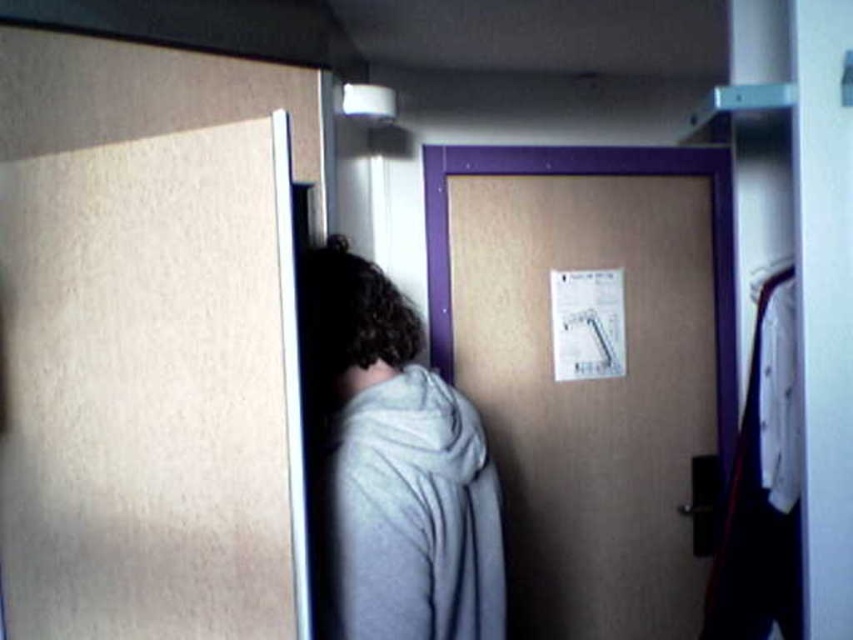
Question: Does gray fleece robe at center appear over wooden door at center?

Choices:
 (A) yes
 (B) no

Answer: (B)

Question: In this image, where is gray fleece robe at center located relative to wooden door at center?

Choices:
 (A) left
 (B) right

Answer: (A)

Question: Which point is closer to the camera?

Choices:
 (A) (711, 188)
 (B) (463, 481)

Answer: (B)

Question: Is gray fleece robe at center closer to the viewer compared to wooden door at center?

Choices:
 (A) yes
 (B) no

Answer: (A)

Question: Among these points, which one is nearest to the camera?

Choices:
 (A) (683, 163)
 (B) (410, 596)

Answer: (B)

Question: Which object is farther from the camera taking this photo?

Choices:
 (A) wooden door at center
 (B) gray fleece robe at center

Answer: (A)